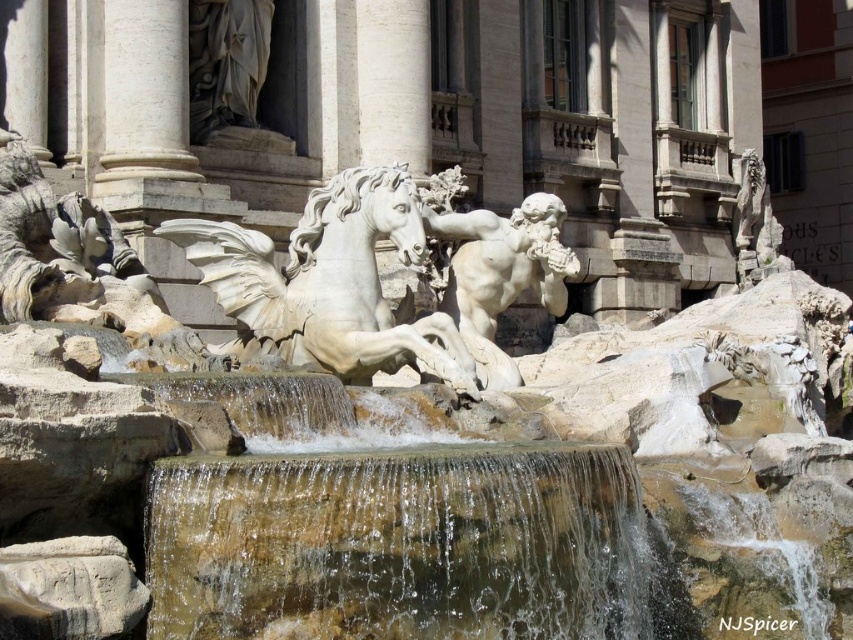
Is the position of white marble horse at center more distant than that of white marble statue at center?

No, it is in front of white marble statue at center.

The image size is (853, 640). In order to click on white marble horse at center in this screenshot , I will do `click(329, 282)`.

Is the position of translucent stone waterfall at center less distant than that of white marble column at upper center?

Yes, it is.

Does translucent stone waterfall at center lie behind white marble column at upper center?

No, it is in front of white marble column at upper center.

Between point (224, 552) and point (119, 116), which one is positioned behind?

Point (119, 116)

Where is `translucent stone waterfall at center`? The height and width of the screenshot is (640, 853). translucent stone waterfall at center is located at coordinates (405, 545).

Can you confirm if translucent stone waterfall at center is wider than white marble statue at center?

Yes, translucent stone waterfall at center is wider than white marble statue at center.

Which is behind, point (428, 525) or point (482, 292)?

The point (482, 292) is behind.

Describe the element at coordinates (405, 545) in the screenshot. The height and width of the screenshot is (640, 853). I see `translucent stone waterfall at center` at that location.

Identify the location of translucent stone waterfall at center. This screenshot has height=640, width=853. (405, 545).